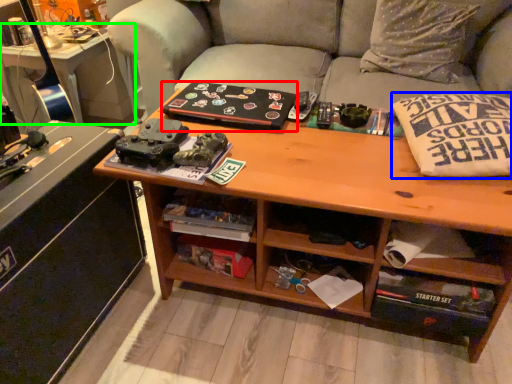
Question: Which object is positioned closest to book (highlighted by a red box)? Select from pillow (highlighted by a blue box) and table (highlighted by a green box).

Choices:
 (A) pillow
 (B) table

Answer: (A)